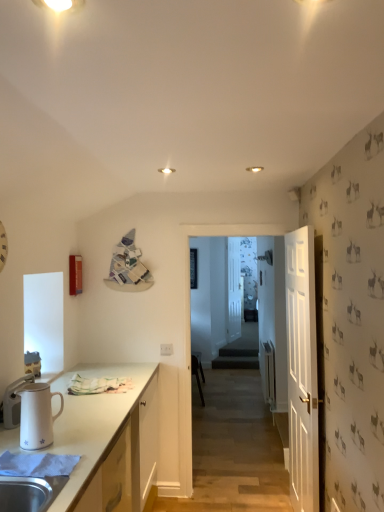
Where is `white glossy pitcher at left`? This screenshot has width=384, height=512. white glossy pitcher at left is located at coordinates (37, 415).

This screenshot has width=384, height=512. Describe the element at coordinates (37, 415) in the screenshot. I see `white glossy pitcher at left` at that location.

This screenshot has width=384, height=512. What do you see at coordinates (3, 246) in the screenshot?
I see `white matte clock at left` at bounding box center [3, 246].

Identify the location of white plastic electric outlet at center. This screenshot has width=384, height=512. (166, 349).

Image resolution: width=384 pixels, height=512 pixels. Find the location of `white wooden door at right`. white wooden door at right is located at coordinates (302, 370).

Describe the element at coordinates (14, 402) in the screenshot. I see `white glossy thermos at left` at that location.

Locate an element on the screen. black plastic chair at center is located at coordinates [x=198, y=374].

Locate an element on the screen. white matte cabinet at lower left is located at coordinates (92, 421).

Find the location of a particular element. Image resolution: width=384 pixels, height=512 pixels. transparent glass door at center is located at coordinates (234, 289).

Locate an element on the screen. The image size is (384, 512). white glossy pitcher at left is located at coordinates (37, 415).

Does white glossy thermos at left come in front of black plastic chair at center?

Yes.

From a real-world perspective, who is located lower, white glossy thermos at left or black plastic chair at center?

black plastic chair at center, from a real-world perspective.

Which object is thinner, white glossy thermos at left or black plastic chair at center?

With smaller width is white glossy thermos at left.

Would you consider white plastic electric outlet at center to be distant from black plastic chair at center?

Yes.

Looking at this image, between white plastic electric outlet at center and black plastic chair at center, which one is positioned in front?

Positioned in front is white plastic electric outlet at center.

Looking at this image, could you tell me if white plastic electric outlet at center is facing black plastic chair at center?

No, white plastic electric outlet at center is not facing towards black plastic chair at center.

Do you think white plastic electric outlet at center is within black plastic chair at center, or outside of it?

white plastic electric outlet at center exists outside the volume of black plastic chair at center.

Is white glossy thermos at left positioned behind white glossy pitcher at left?

Yes, white glossy thermos at left is further from the camera.

Would you say white glossy thermos at left is inside or outside white glossy pitcher at left?

white glossy thermos at left cannot be found inside white glossy pitcher at left.

Does point (19, 384) come behind point (49, 418)?

Yes.

Identify the location of pitcher in front of the white matte clock at left. (37, 415).

Is white glossy pitcher at left located within white matte clock at left?

That's incorrect, white glossy pitcher at left is not inside white matte clock at left.

Is white matte clock at left oriented away from white glossy pitcher at left?

No, white matte clock at left is not facing the opposite direction of white glossy pitcher at left.

Locate an element on the screen. This screenshot has width=384, height=512. pitcher lying in front of the transparent glass door at center is located at coordinates (37, 415).

Is transparent glass door at center completely or partially outside of white glossy pitcher at left?

transparent glass door at center is positioned outside white glossy pitcher at left.

Would you consider transparent glass door at center to be distant from white glossy pitcher at left?

Yes, transparent glass door at center is far from white glossy pitcher at left.

What's the angular difference between transparent glass door at center and white glossy pitcher at left's facing directions?

21.9 degrees.

Are white matte clock at left and transparent glass door at center beside each other?

white matte clock at left and transparent glass door at center are not in contact.

Can you confirm if white matte clock at left is smaller than transparent glass door at center?

Indeed, white matte clock at left has a smaller size compared to transparent glass door at center.

Which point is more distant from viewer, (7, 253) or (229, 265)?

The point (229, 265) is farther from the camera.

Considering the positions of objects white matte clock at left and transparent glass door at center in the image provided, who is more to the left, white matte clock at left or transparent glass door at center?

white matte clock at left.

How many degrees apart are the facing directions of white glossy pitcher at left and transparent glass door at center?

They differ by 21.9 degrees in their facing directions.

Is white glossy pitcher at left taller than transparent glass door at center?

No.

Is white glossy pitcher at left positioned with its back to transparent glass door at center?

white glossy pitcher at left is not turned away from transparent glass door at center.

Where is `appliance that is in front of the black plastic chair at center`? appliance that is in front of the black plastic chair at center is located at coordinates (14, 402).

Image resolution: width=384 pixels, height=512 pixels. Find the location of `electric outlet that appears on the left of black plastic chair at center`. electric outlet that appears on the left of black plastic chair at center is located at coordinates (166, 349).

Looking at the image, which one is located further to white matte cabinet at lower left, white glossy thermos at left or transparent glass door at center?

Based on the image, transparent glass door at center appears to be further to white matte cabinet at lower left.

Considering their positions, is white wooden door at right positioned further to white matte clock at left than white matte cabinet at lower left?

Among the two, white wooden door at right is located further to white matte clock at left.

Estimate the real-world distances between objects in this image. Which object is closer to white glossy pitcher at left, white plastic electric outlet at center or black plastic chair at center?

white plastic electric outlet at center lies closer to white glossy pitcher at left than the other object.

Considering their positions, is black plastic chair at center positioned closer to transparent glass door at center than white wooden door at right?

black plastic chair at center lies closer to transparent glass door at center than the other object.

Estimate the real-world distances between objects in this image. Which object is further from white glossy thermos at left, white matte cabinet at lower left or white plastic electric outlet at center?

Based on the image, white plastic electric outlet at center appears to be further to white glossy thermos at left.

Estimate the real-world distances between objects in this image. Which object is further from transparent glass door at center, white wooden door at right or black plastic chair at center?

Based on the image, white wooden door at right appears to be further to transparent glass door at center.

Based on their spatial positions, is white glossy thermos at left or white matte cabinet at lower left closer to black plastic chair at center?

The object closer to black plastic chair at center is white matte cabinet at lower left.

From the image, which object appears to be farther from white wooden door at right, black plastic chair at center or white glossy thermos at left?

black plastic chair at center.

The image size is (384, 512). What are the coordinates of `door positioned between white glossy pitcher at left and transparent glass door at center from near to far` in the screenshot? It's located at (302, 370).

This screenshot has height=512, width=384. I want to click on cabinetry between white glossy pitcher at left and transparent glass door at center along the z-axis, so click(92, 421).

The height and width of the screenshot is (512, 384). I want to click on pitcher between white matte clock at left and white glossy thermos at left in the up-down direction, so click(x=37, y=415).

In order to click on electric outlet located between white glossy pitcher at left and black plastic chair at center in the depth direction in this screenshot , I will do `click(166, 349)`.